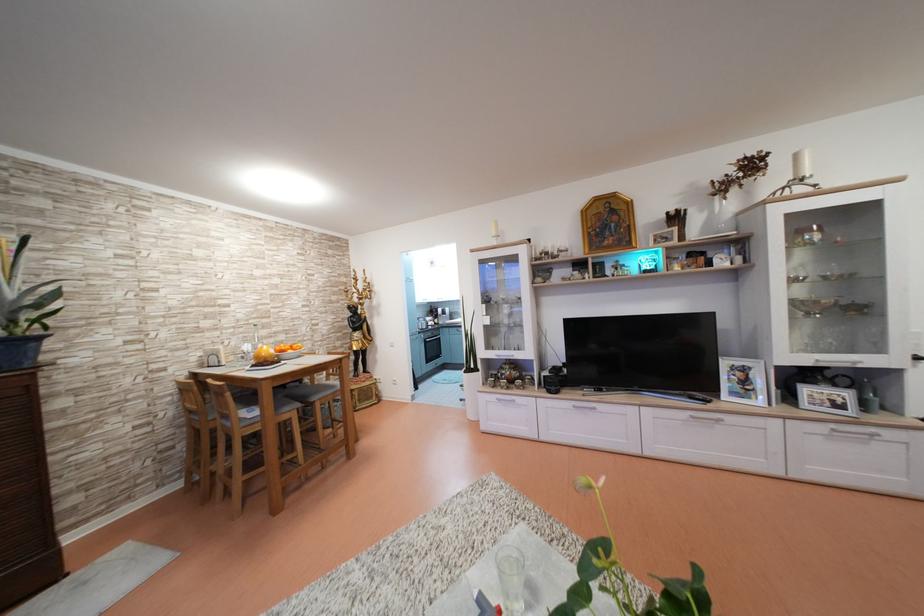
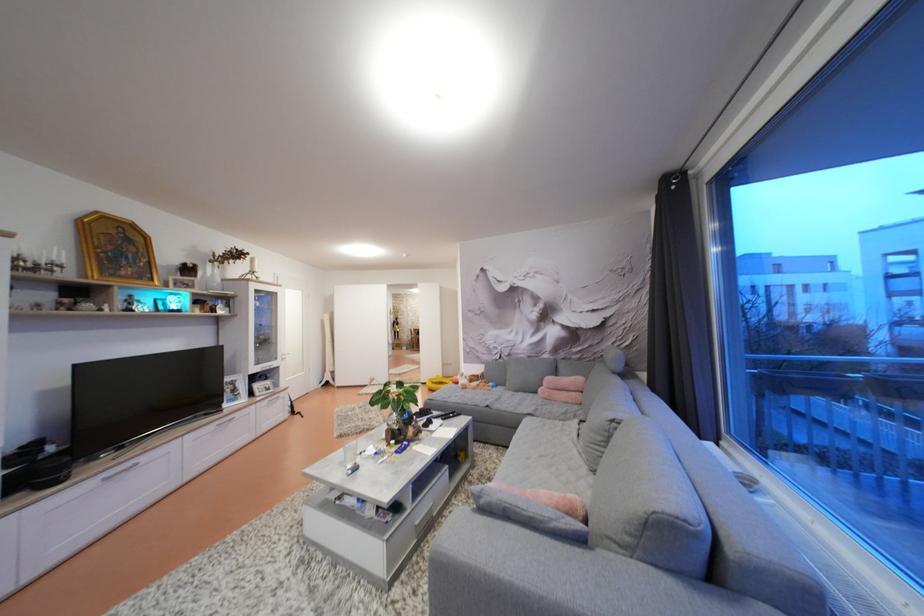
In the second image, find the point that corresponds to [719,217] in the first image.

(213, 278)